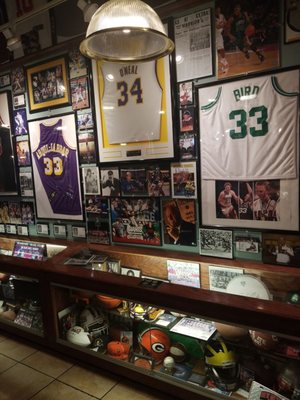
At what (x,y) coordinates should I click in order to perform the action: click on tiles. Please return your answer as a coordinate pair (x, y). This screenshot has width=300, height=400. Looking at the image, I should click on (40, 369), (29, 383), (8, 365), (17, 346), (80, 380), (66, 392), (126, 394).